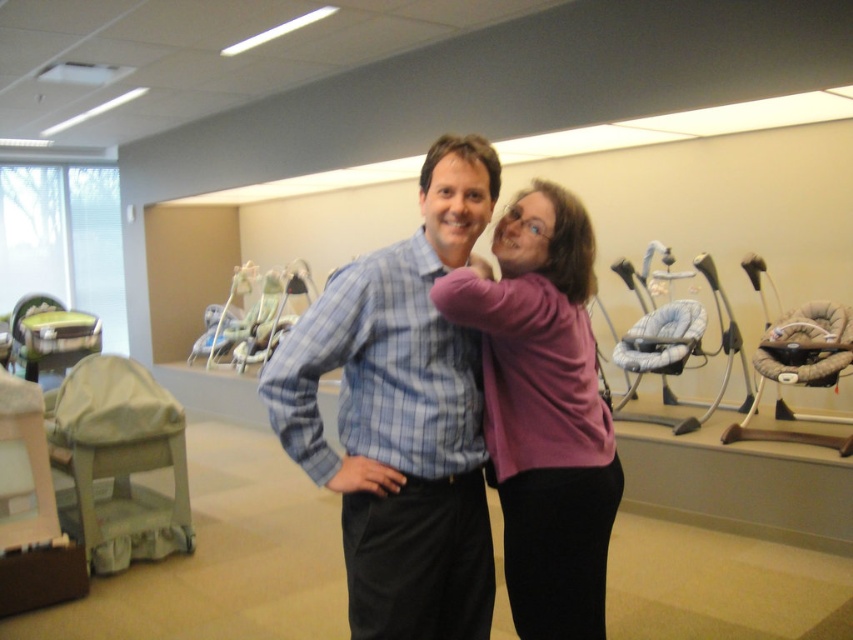
Question: Among these objects, which one is farthest from the camera?

Choices:
 (A) purple sweater at center
 (B) blue plaid shirt at center

Answer: (B)

Question: Is blue plaid shirt at center further to the viewer compared to purple sweater at center?

Choices:
 (A) yes
 (B) no

Answer: (A)

Question: Is blue plaid shirt at center below purple sweater at center?

Choices:
 (A) no
 (B) yes

Answer: (A)

Question: Which point is closer to the camera?

Choices:
 (A) blue plaid shirt at center
 (B) purple sweater at center

Answer: (B)

Question: Among these objects, which one is nearest to the camera?

Choices:
 (A) purple sweater at center
 (B) blue plaid shirt at center

Answer: (A)

Question: Does blue plaid shirt at center have a lesser width compared to purple sweater at center?

Choices:
 (A) yes
 (B) no

Answer: (B)